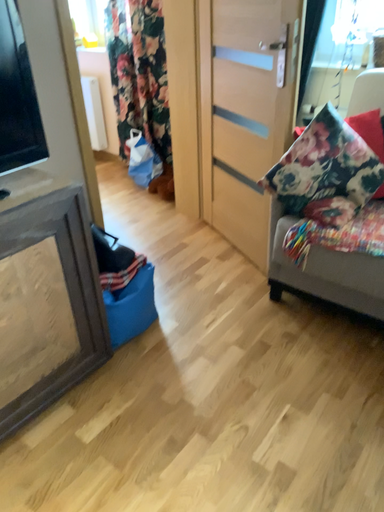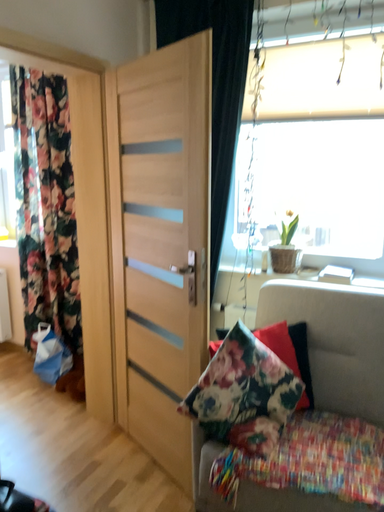
Question: How did the camera likely rotate when shooting the video?

Choices:
 (A) rotated upward
 (B) rotated downward

Answer: (A)